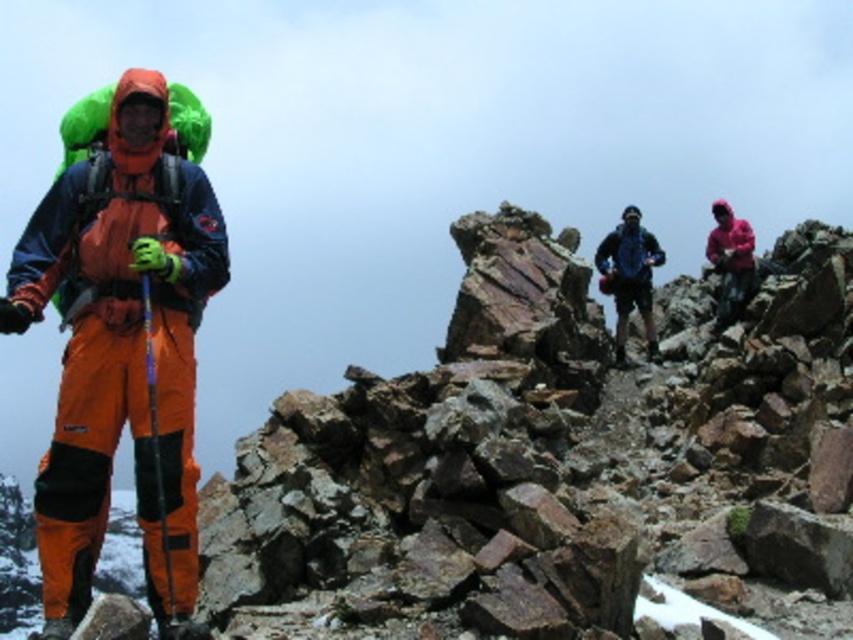
Looking at this image, who is positioned more to the right, rugged stone mountain at center or orange softshell jacket at left?

rugged stone mountain at center is more to the right.

Which is behind, point (718, 532) or point (172, 429)?

Positioned behind is point (718, 532).

Locate an element on the screen. This screenshot has width=853, height=640. rugged stone mountain at center is located at coordinates (550, 460).